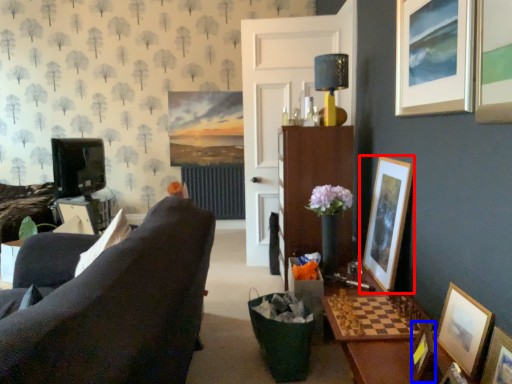
Question: Which of the following is the farthest to the observer, picture frame (highlighted by a red box) or picture frame (highlighted by a blue box)?

Choices:
 (A) picture frame
 (B) picture frame

Answer: (A)